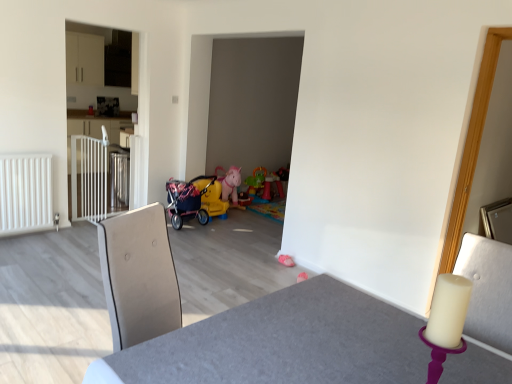
Question: Is white glossy cabinet at left inside or outside of white matte radiator at left?

Choices:
 (A) inside
 (B) outside

Answer: (B)

Question: From a real-world perspective, is white glossy cabinet at left positioned above or below white matte radiator at left?

Choices:
 (A) below
 (B) above

Answer: (B)

Question: Which object is the closest to the plastic rainbow play table at center, which ranks as the second toy in front-to-back order?

Choices:
 (A) white metallic gate at left
 (B) white matte radiator at left
 (C) smooth gray table at center
 (D) pink fabric toy at lower center, the first toy positioned from the bottom
 (E) white glossy cabinet at left

Answer: (D)

Question: Considering the real-world distances, which object is farthest from the plastic rainbow play table at center, which is the 1th toy in top-to-bottom order?

Choices:
 (A) white metallic gate at left
 (B) white glossy cabinet at left
 (C) white matte radiator at left
 (D) smooth gray table at center
 (E) pink fabric toy at lower center, the first toy when ordered from front to back

Answer: (D)